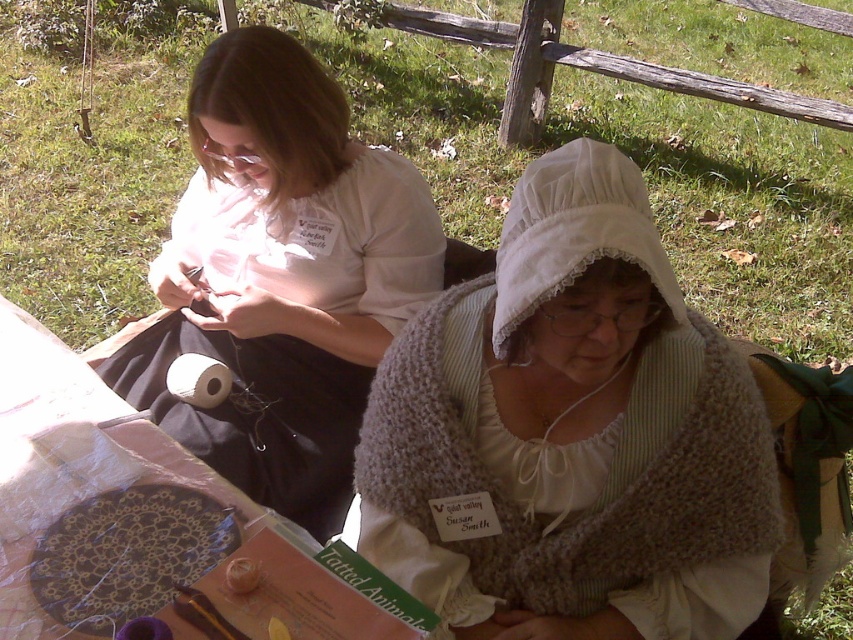
You are an observer standing in front of the scene. You see the white knit shawl at center and the matte white shirt at upper left. Which object takes up more space in the image?

The matte white shirt at upper left takes up more space in the image than the white knit shawl at center because the white knit shawl at center occupies less space than matte white shirt at upper left.

You are standing in the grassy area and want to place a small decorative item between the white knit shawl at center and the matte white shirt at upper left. Which object should you place it closer to if you want it to be nearer to the right side of the scene?

The white knit shawl at center is to the right of the matte white shirt at upper left, so placing the item closer to the white knit shawl at center would position it nearer to the right side of the scene.